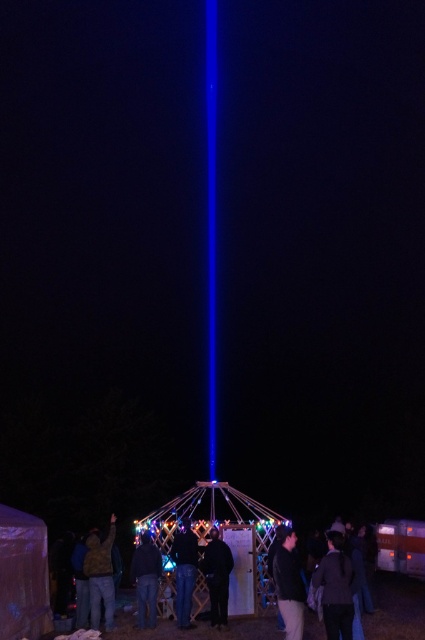
In the scene shown: You are a photographer standing at the edge of the crowd. You want to capture a photo that includes both the dark gray fabric at lower right and the jeans at center. What is the minimum distance you need to move backward to ensure both objects are in frame?

The minimum distance you need to move backward is 5.56 meters to ensure both the dark gray fabric at lower right and the jeans at center are in frame.

You are organizing a small gathering and need to decide which item can cover a larger area for a tablecloth or a jacket. Based on the scene, which object is wider between the dark gray fabric at lower right and the brown leather jacket at lower left?

The dark gray fabric at lower right is wider than the brown leather jacket at lower left according to the description.

You are standing at the center of the image and want to locate the dark gray fabric at lower right. In which direction should you move to reach it?

The dark gray fabric at lower right is located at coordinate point 0.919 on the x axis and 0.791 on the y axis, so you should move to the right and down from the center to reach it.